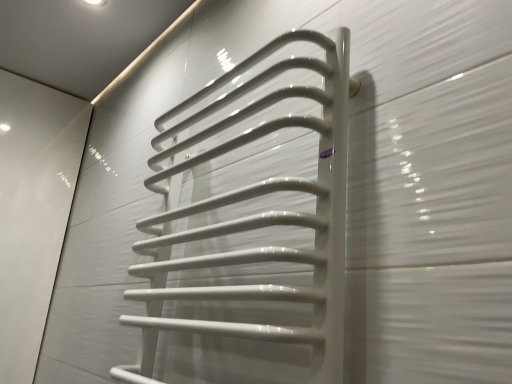
Find the location of a particular element. white glossy towel rack at center is located at coordinates (254, 214).

The width and height of the screenshot is (512, 384). What do you see at coordinates (254, 214) in the screenshot?
I see `white glossy towel rack at center` at bounding box center [254, 214].

Consider the image. Measure the distance between point (238, 327) and camera.

The distance of point (238, 327) from camera is 22.20 inches.

This screenshot has width=512, height=384. Identify the location of white glossy towel rack at center. tap(254, 214).